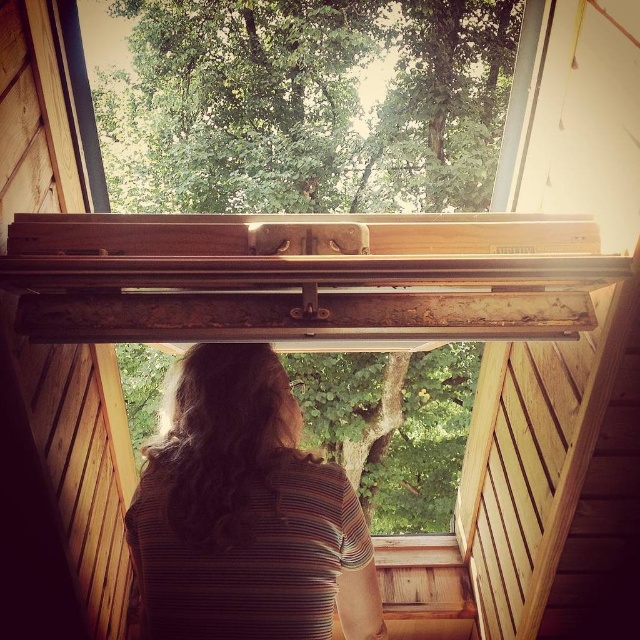
Question: Can you confirm if green leafy tree at upper center is positioned to the left of brown striped shirt at center?

Choices:
 (A) no
 (B) yes

Answer: (A)

Question: Which point appears closest to the camera in this image?

Choices:
 (A) (152, 627)
 (B) (486, 10)

Answer: (A)

Question: Considering the relative positions of green leafy tree at upper center and brown striped shirt at center in the image provided, where is green leafy tree at upper center located with respect to brown striped shirt at center?

Choices:
 (A) right
 (B) left

Answer: (A)

Question: Among these objects, which one is farthest from the camera?

Choices:
 (A) brown striped shirt at center
 (B) green leafy tree at upper center

Answer: (B)

Question: Which object is farther from the camera taking this photo?

Choices:
 (A) brown striped shirt at center
 (B) green leafy tree at upper center

Answer: (B)

Question: Is green leafy tree at upper center to the left of brown striped shirt at center from the viewer's perspective?

Choices:
 (A) yes
 (B) no

Answer: (B)